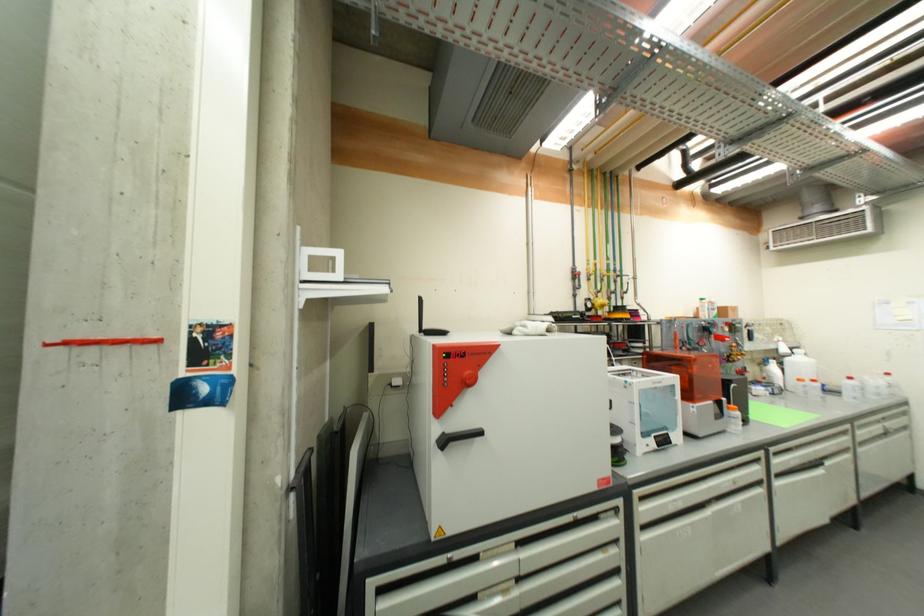
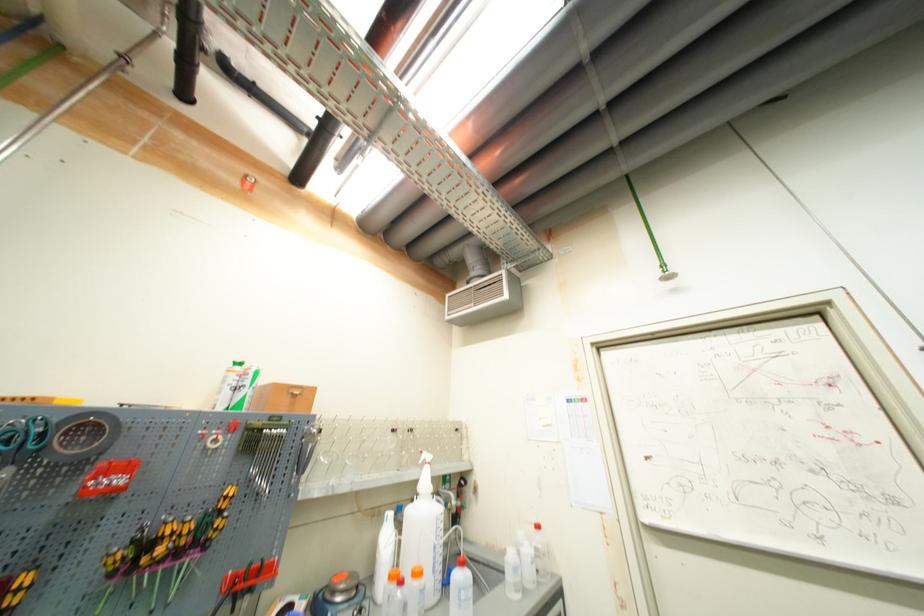
In the second image, find the point that corresponds to [670,205] in the first image.

(253, 185)